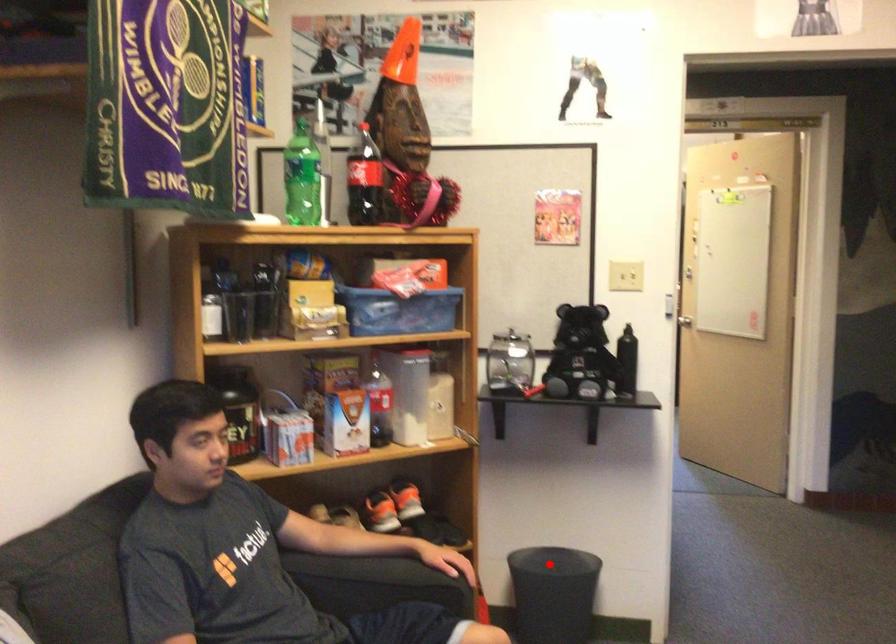
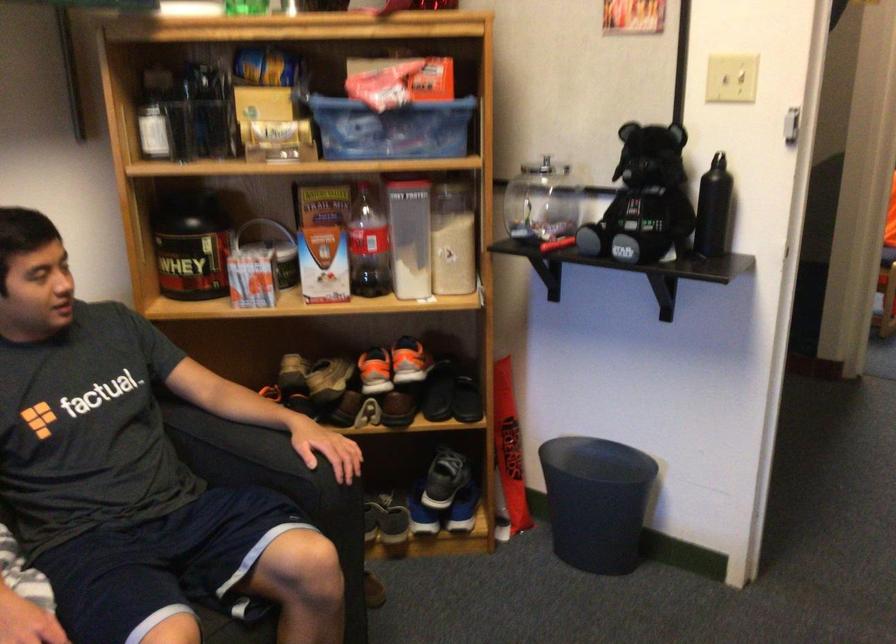
Question: I am providing you with two images of the same scene from different viewpoints. A red point is shown in image1. For the corresponding object point in image2, is it positioned nearer or farther from the camera?

Choices:
 (A) Nearer
 (B) Farther

Answer: (A)